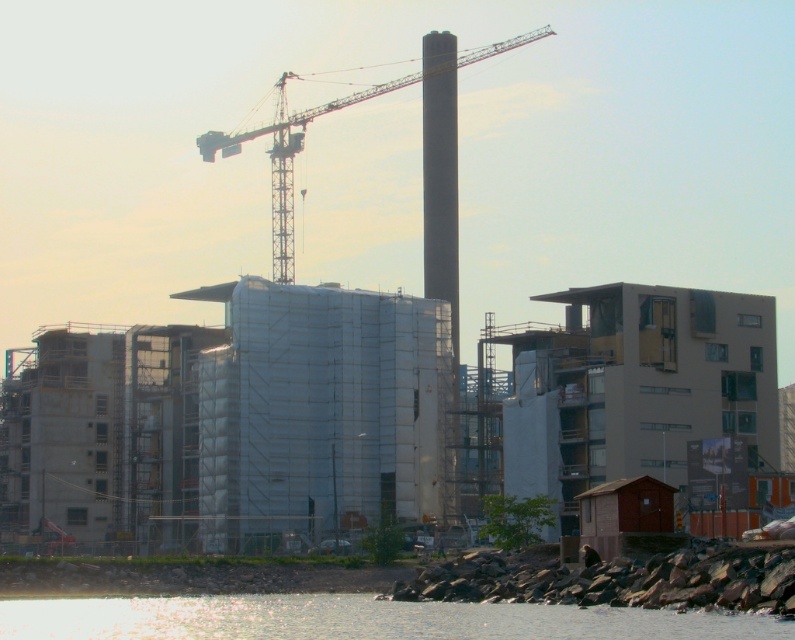
Question: Is transparent water at lower left in front of metallic gray crane at upper center?

Choices:
 (A) no
 (B) yes

Answer: (B)

Question: Does transparent water at lower left have a greater width compared to metallic gray crane at upper center?

Choices:
 (A) no
 (B) yes

Answer: (A)

Question: Which of the following is the closest to the observer?

Choices:
 (A) transparent water at lower left
 (B) metallic gray crane at upper center

Answer: (A)

Question: Where is transparent water at lower left located in relation to metallic gray crane at upper center in the image?

Choices:
 (A) right
 (B) left

Answer: (A)